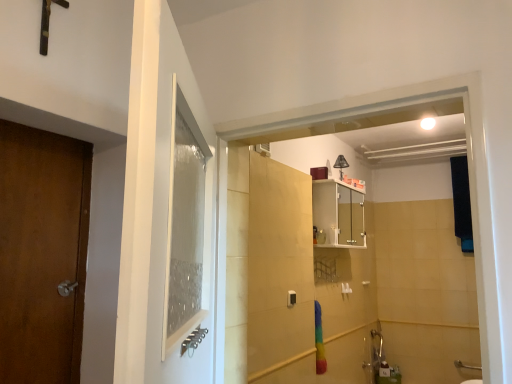
Question: From a real-world perspective, is matte black lampshade at upper center located higher than white glossy cabinet at upper center?

Choices:
 (A) no
 (B) yes

Answer: (B)

Question: Considering the relative sizes of matte black lampshade at upper center and white glossy cabinet at upper center in the image provided, is matte black lampshade at upper center bigger than white glossy cabinet at upper center?

Choices:
 (A) yes
 (B) no

Answer: (B)

Question: Considering the relative sizes of matte black lampshade at upper center and white glossy cabinet at upper center in the image provided, is matte black lampshade at upper center thinner than white glossy cabinet at upper center?

Choices:
 (A) yes
 (B) no

Answer: (A)

Question: Is matte black lampshade at upper center to the right of white glossy cabinet at upper center from the viewer's perspective?

Choices:
 (A) no
 (B) yes

Answer: (B)

Question: From the image's perspective, does matte black lampshade at upper center appear higher than white glossy cabinet at upper center?

Choices:
 (A) yes
 (B) no

Answer: (A)

Question: Is matte black lampshade at upper center completely or partially outside of white glossy cabinet at upper center?

Choices:
 (A) no
 (B) yes

Answer: (B)

Question: Is white glossy cabinet at upper center bigger than matte black lampshade at upper center?

Choices:
 (A) yes
 (B) no

Answer: (A)

Question: Can you confirm if white glossy cabinet at upper center is wider than matte black lampshade at upper center?

Choices:
 (A) yes
 (B) no

Answer: (A)

Question: Is white glossy cabinet at upper center thinner than matte black lampshade at upper center?

Choices:
 (A) no
 (B) yes

Answer: (A)

Question: Is white glossy cabinet at upper center to the left of matte black lampshade at upper center from the viewer's perspective?

Choices:
 (A) no
 (B) yes

Answer: (B)

Question: From a real-world perspective, is white glossy cabinet at upper center over matte black lampshade at upper center?

Choices:
 (A) yes
 (B) no

Answer: (B)

Question: Is white glossy cabinet at upper center taller than matte black lampshade at upper center?

Choices:
 (A) yes
 (B) no

Answer: (A)

Question: In the image, is white glossy cabinet at upper center on the left side or the right side of matte black lampshade at upper center?

Choices:
 (A) left
 (B) right

Answer: (A)